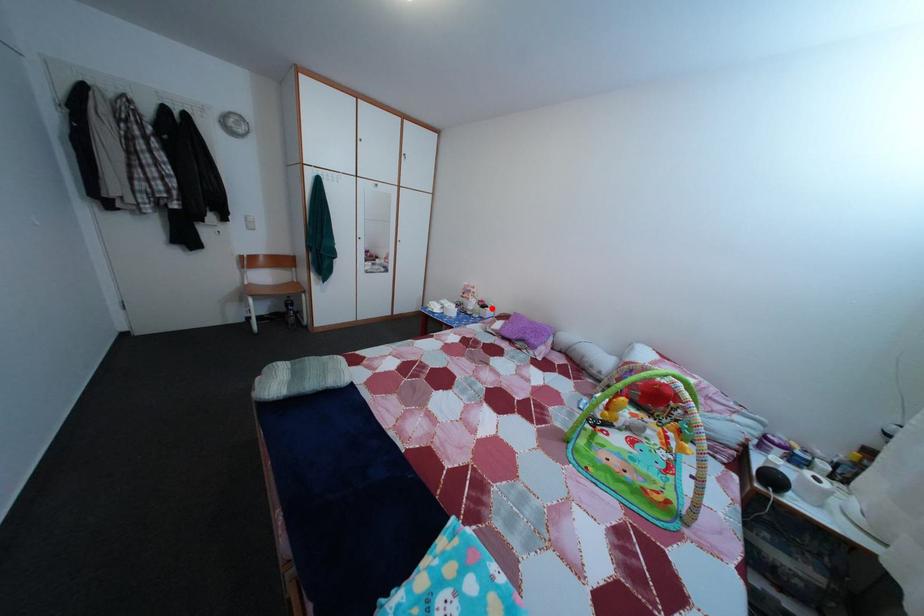
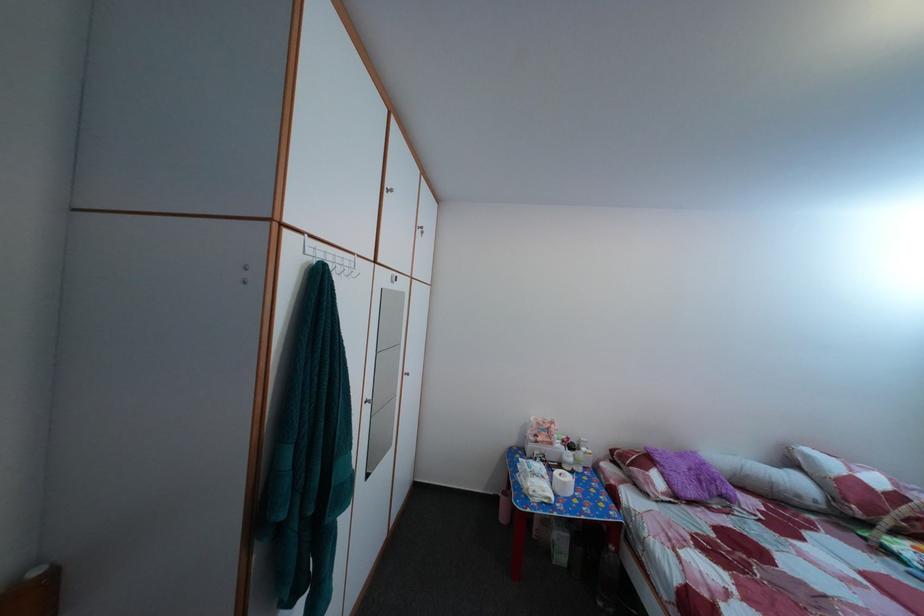
Where in the second image is the point corresponding to the highlighted location from the first image?

(578, 447)